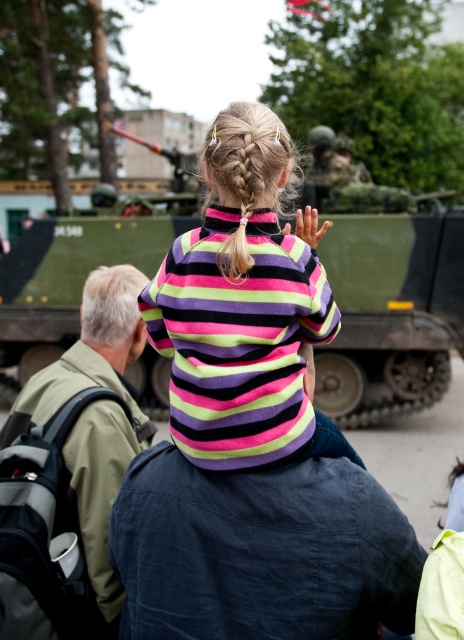
Consider the image. Between striped jersey at center and green fabric backpack at upper left, which one appears on the left side from the viewer's perspective?

green fabric backpack at upper left

Who is more forward, (212, 352) or (97, 563)?

Point (212, 352) is more forward.

Where is `striped jersey at center`? The image size is (464, 640). striped jersey at center is located at coordinates (244, 308).

Does dark blue fabric shirt at center have a lesser height compared to green matte tank at center?

No, dark blue fabric shirt at center is not shorter than green matte tank at center.

Can you confirm if dark blue fabric shirt at center is positioned below green matte tank at center?

No.

Is point (394, 614) more distant than point (330, 417)?

No, it is not.

What are the coordinates of `dark blue fabric shirt at center` in the screenshot? It's located at [x=260, y=552].

Who is taller, striped jersey at center or blonde hair at upper center?

striped jersey at center is taller.

Is point (192, 417) farther from viewer compared to point (438, 524)?

No, (192, 417) is in front of (438, 524).

Describe the element at coordinates (244, 308) in the screenshot. I see `striped jersey at center` at that location.

Find the location of a particular element. Image resolution: width=464 pixels, height=640 pixels. striped jersey at center is located at coordinates (244, 308).